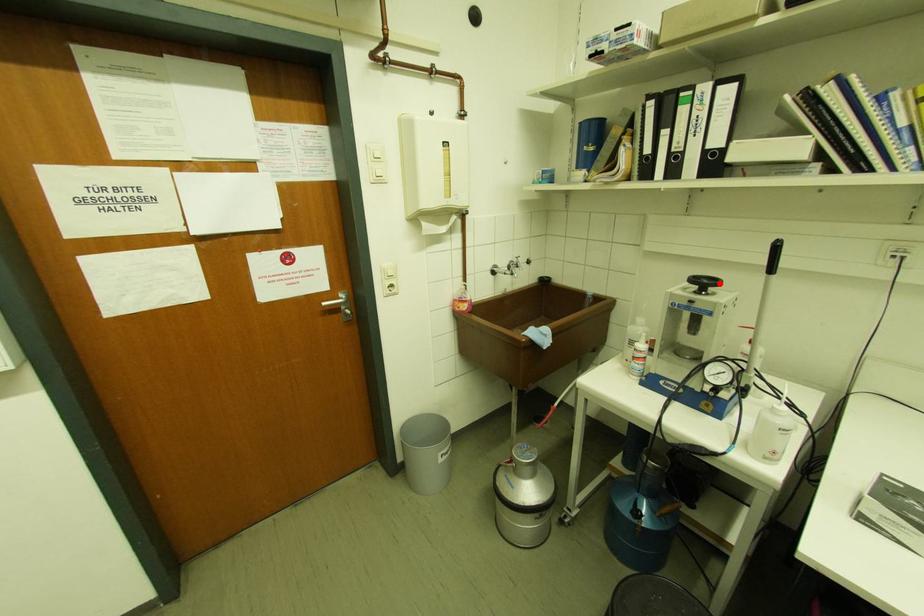
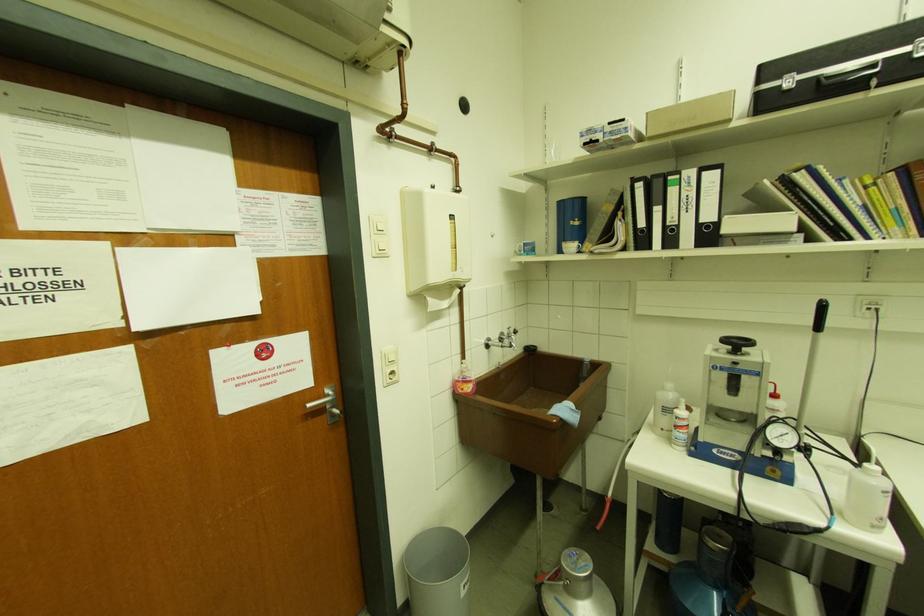
Where in the second image is the point corresponding to the highlighted location from the first image?

(752, 344)